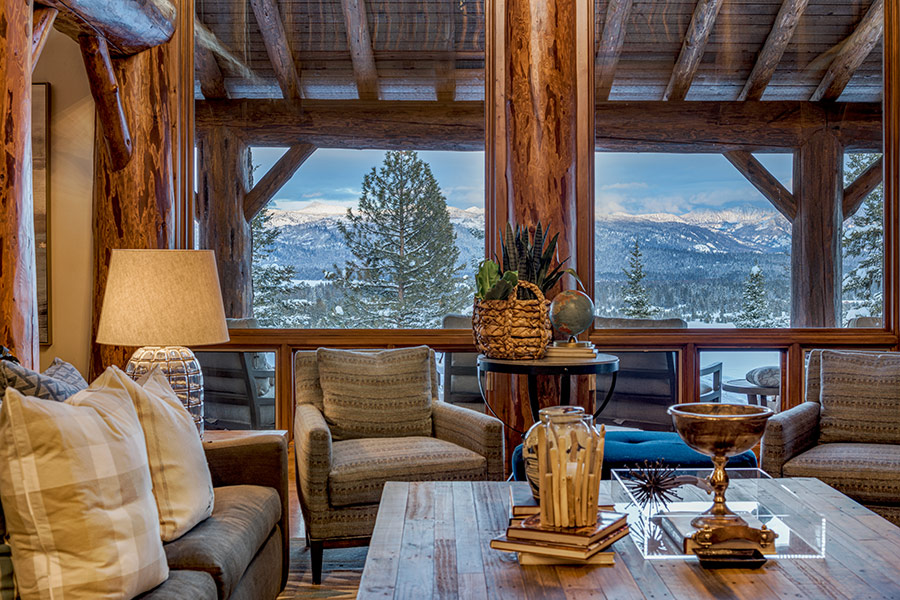
You are a GUI agent. You are given a task and a screenshot of the screen. Output one action in this format:
    pyautogui.click(x=<x>, y=<y>)
    Task: Click on the light gold squares on pillow
    
    Given the screenshot: What is the action you would take?
    pyautogui.click(x=79, y=505), pyautogui.click(x=51, y=429), pyautogui.click(x=67, y=542), pyautogui.click(x=95, y=565), pyautogui.click(x=133, y=483)